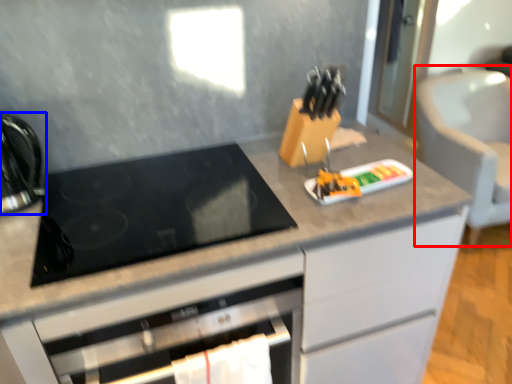
Question: Which point is further to the camera, armchair (highlighted by a red box) or kitchen appliance (highlighted by a blue box)?

Choices:
 (A) armchair
 (B) kitchen appliance

Answer: (A)